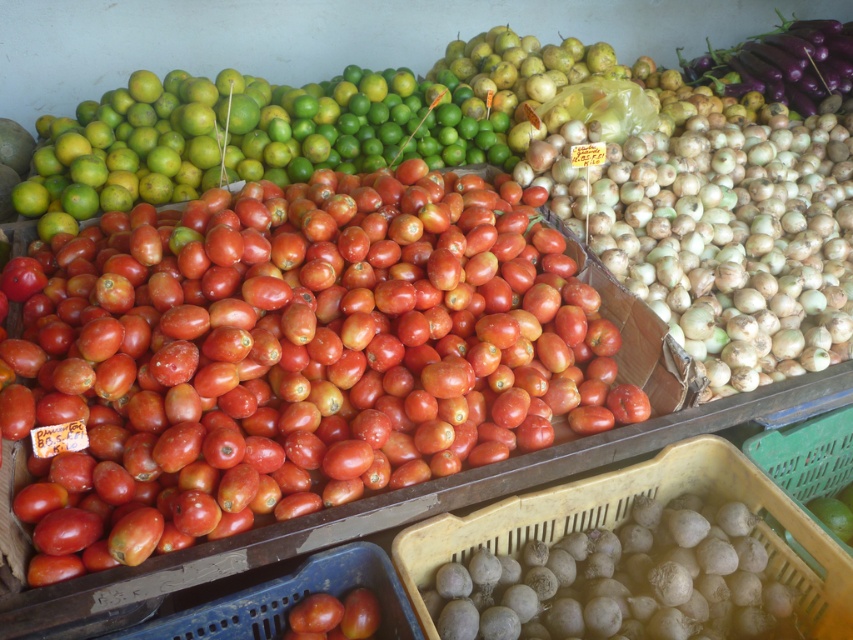
You are a customer at the market stall looking at the shiny red tomato at center. If you want to reach it, which direction should you move relative to your current position?

Since the shiny red tomato at center is located at point 0.586 on the x axis and 0.341 on the y axis, you should move towards the center of the image to reach it.

You are standing at the market stall and want to reach the point at coordinates point [210,458]. If your arm can extend 1.30 meters, can you reach that point?

The point [210,458] is 1.40 meters from the viewer. Since your arm can only extend 1.30 meters, you cannot reach it.

You are a customer at the market stall and want to buy the tallest tomato. Which one should you choose between the shiny red tomato at center and the shiny red tomatoes at center?

The shiny red tomato at center is taller than the shiny red tomatoes at center, so you should choose the shiny red tomato at center.